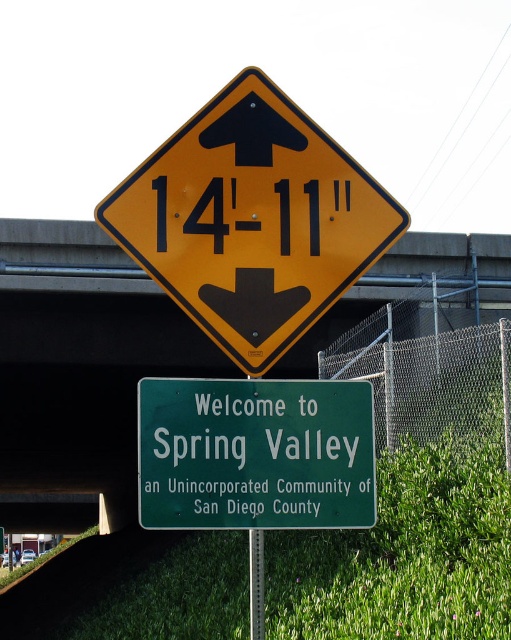
Question: Is brushed metal overpass at upper center to the right of chain link fence at center right from the viewer's perspective?

Choices:
 (A) yes
 (B) no

Answer: (B)

Question: Which of the following is the farthest from the observer?

Choices:
 (A) green metallic pole at lower center
 (B) brushed metal overpass at upper center
 (C) yellow matte diamond at upper center
 (D) chain link fence at center right

Answer: (D)

Question: Is green matte signboard at center thinner than green metallic pole at lower center?

Choices:
 (A) yes
 (B) no

Answer: (B)

Question: Estimate the real-world distances between objects in this image. Which object is closer to the green metallic pole at lower center?

Choices:
 (A) yellow matte diamond at upper center
 (B) green matte signboard at center
 (C) chain link fence at center right

Answer: (B)

Question: Which of the following is the closest to the observer?

Choices:
 (A) brushed metal overpass at upper center
 (B) green metallic pole at lower center
 (C) green matte signboard at center

Answer: (C)

Question: Is chain link fence at center right above green metallic pole at lower center?

Choices:
 (A) no
 (B) yes

Answer: (B)